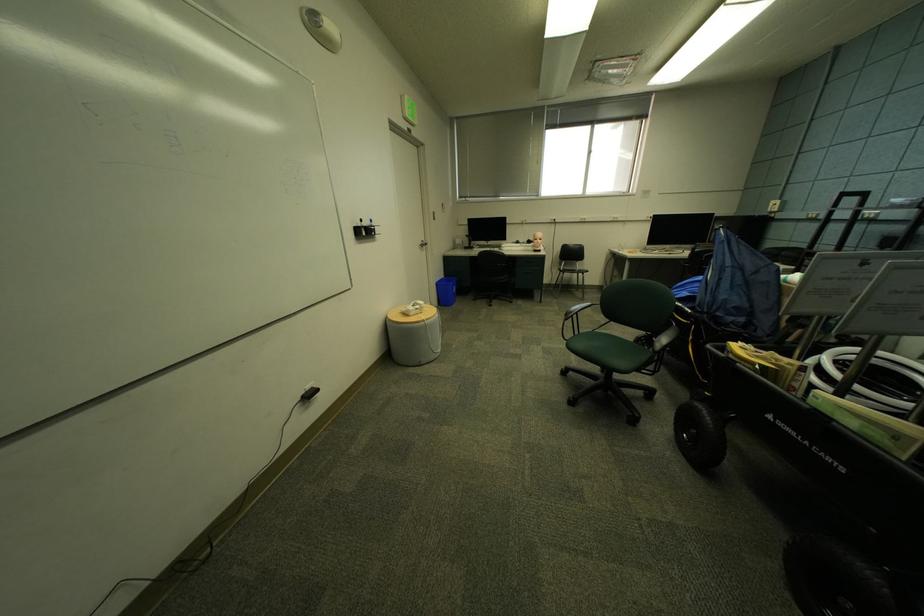
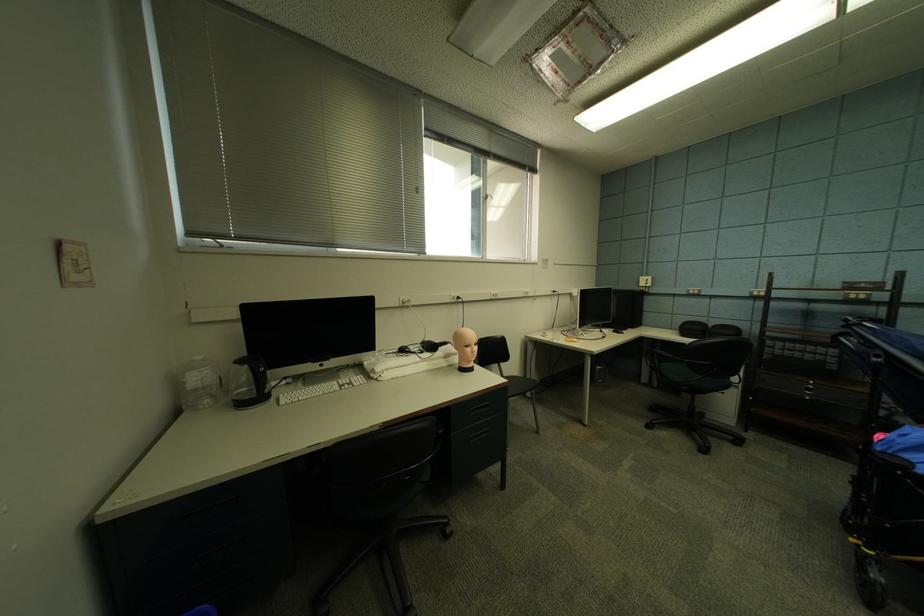
Find the pixel in the second image that matches point (780, 206) in the first image.

(650, 282)